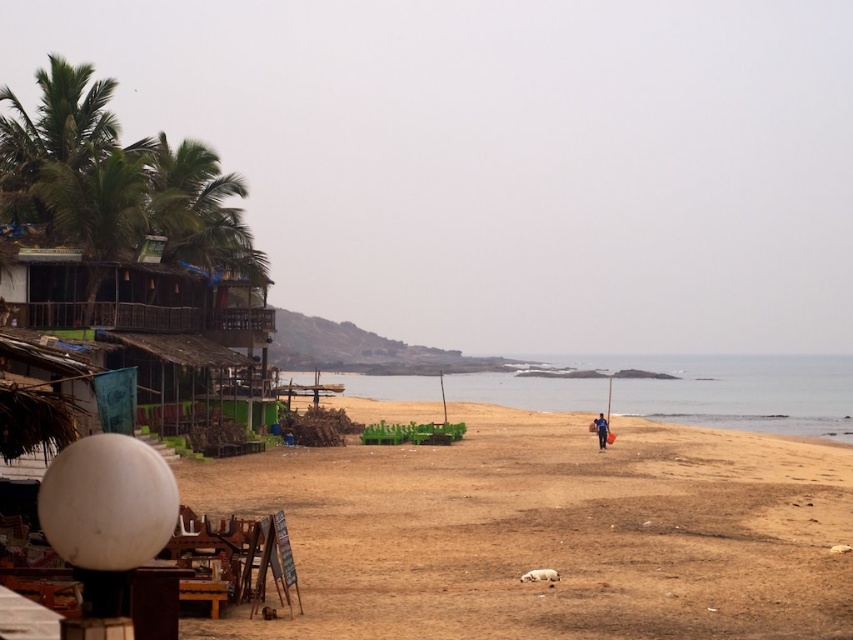
You are standing at the point marked by coordinates point (550, 532) in the image. Based on the scene described, what type of terrain are you currently standing on?

You are standing on the brown sandy beach at lower center, as the coordinates point (550, 532) marks this location.

You are standing on the brown sandy beach at lower center and want to reach the clear blue water at center. Which direction should you move in?

You should move forward towards the clear blue water at center since the brown sandy beach at lower center is in front of it.

You are standing at the wooden hut at left and want to walk to the brown sandy beach at lower center. In which direction should you move?

You should move to the right to reach the brown sandy beach at lower center from the wooden hut at left since the brown sandy beach at lower center is located to the right of the wooden hut at left.